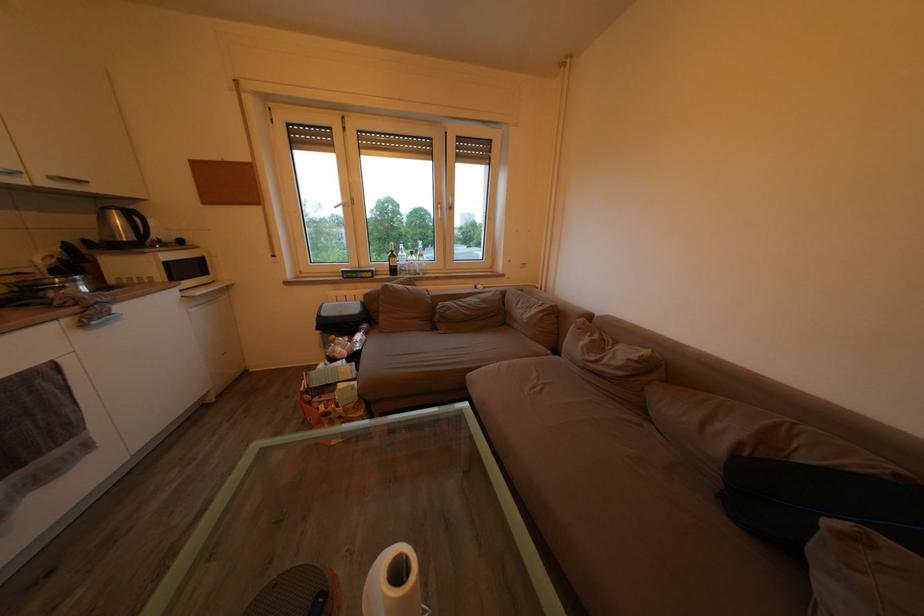
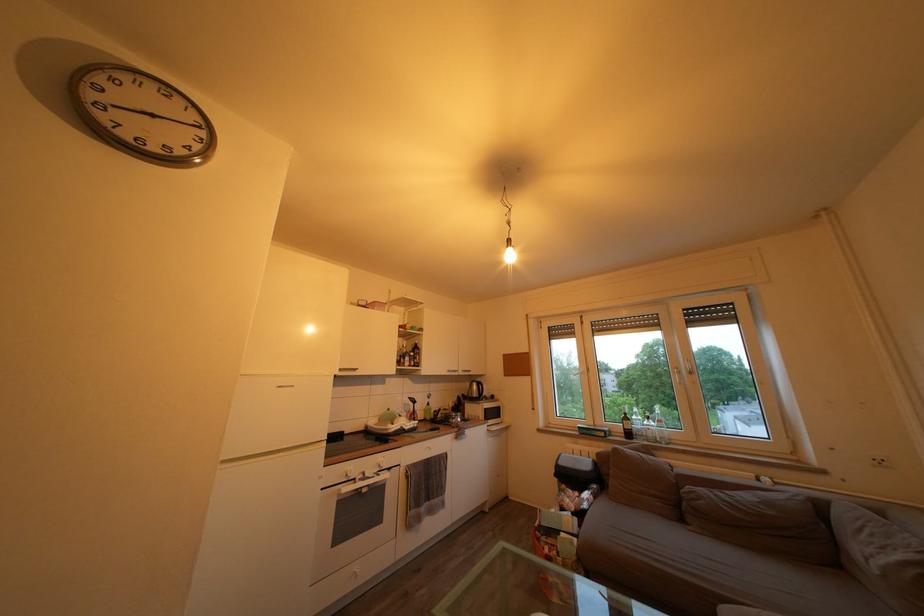
Locate, in the second image, the point that corresponds to the point at 180,300 in the first image.

(492, 434)